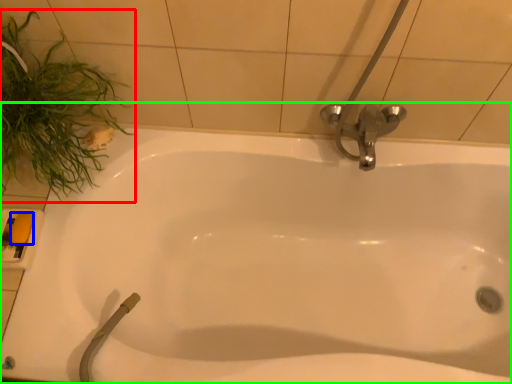
Question: Which object is the closest to the plant (highlighted by a red box)? Choose among these: soap (highlighted by a blue box) or bathtub (highlighted by a green box).

Choices:
 (A) soap
 (B) bathtub

Answer: (A)